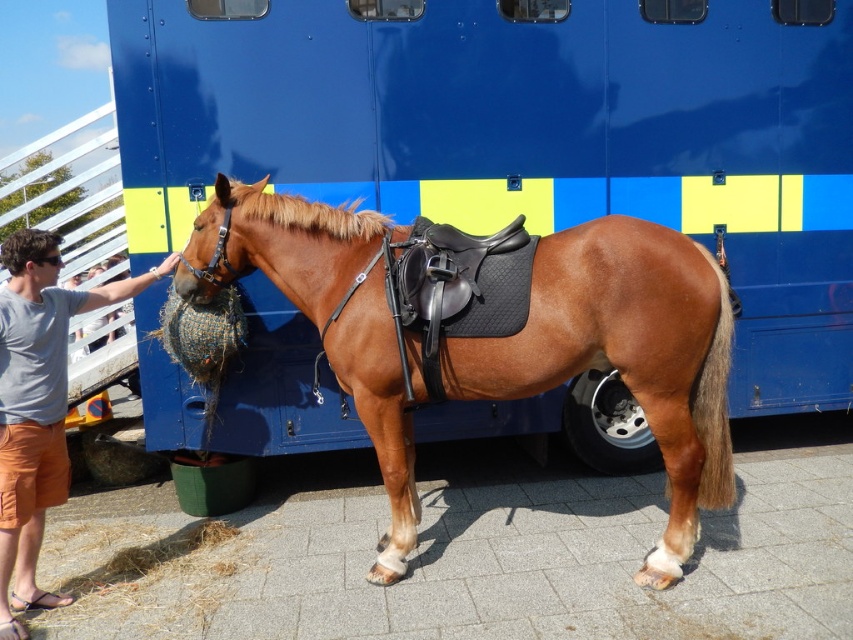
Question: Is brown glossy horse at center bigger than light blue cotton shirt at left?

Choices:
 (A) yes
 (B) no

Answer: (A)

Question: Which object is farther from the camera taking this photo?

Choices:
 (A) light blue cotton shirt at left
 (B) brown glossy horse at center

Answer: (B)

Question: Which of the following is the closest to the observer?

Choices:
 (A) brown glossy horse at center
 (B) light blue cotton shirt at left

Answer: (B)

Question: Does brown glossy horse at center lie behind light blue cotton shirt at left?

Choices:
 (A) no
 (B) yes

Answer: (B)

Question: Which object appears farthest from the camera in this image?

Choices:
 (A) brown glossy horse at center
 (B) light blue cotton shirt at left

Answer: (A)

Question: Is brown glossy horse at center closer to camera compared to light blue cotton shirt at left?

Choices:
 (A) yes
 (B) no

Answer: (B)